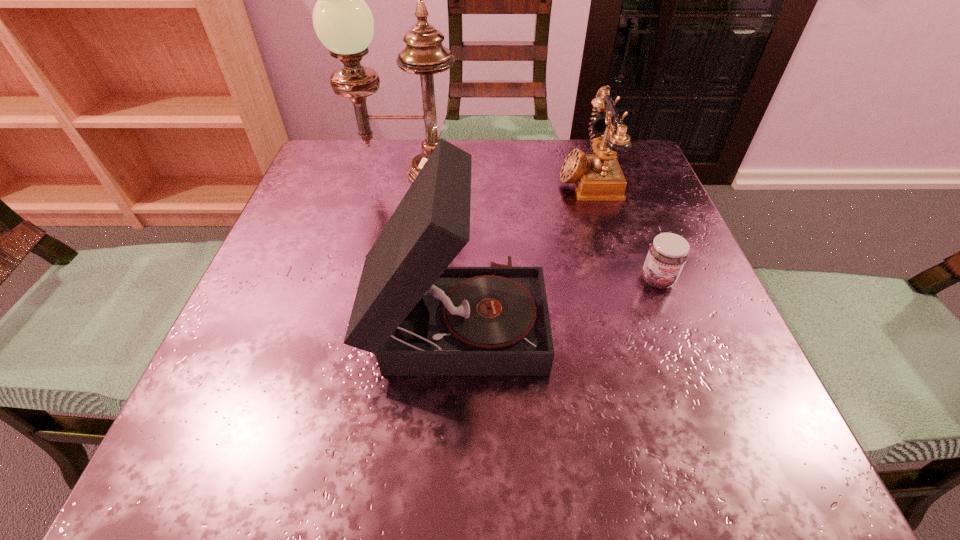
This screenshot has width=960, height=540. Find the location of `free space between the shortest object and the phonograph_record`. free space between the shortest object and the phonograph_record is located at coordinates (557, 299).

The width and height of the screenshot is (960, 540). Identify the location of vacant space that is in between the phonograph_record and the telephone. (521, 247).

Locate an element on the screen. Image resolution: width=960 pixels, height=540 pixels. vacant space that's between the phonograph_record and the third tallest object is located at coordinates (521, 247).

Locate an element on the screen. The width and height of the screenshot is (960, 540). object identified as the closest to the jam is located at coordinates (598, 177).

Identify the location of object that stands as the closest to the telephone. (667, 254).

Where is `vacant region that satisfies the following two spatial constraints: 1. on the front label of the shortest object; 2. on the front-facing side of the second tallest object`? vacant region that satisfies the following two spatial constraints: 1. on the front label of the shortest object; 2. on the front-facing side of the second tallest object is located at coordinates (672, 318).